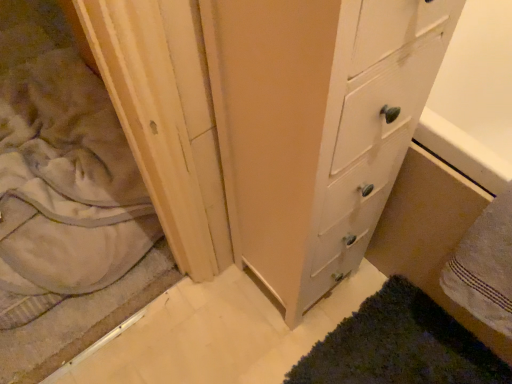
Question: Can you confirm if white textured towel at lower right is bigger than white wood chest of drawers at center?

Choices:
 (A) no
 (B) yes

Answer: (A)

Question: Is white textured towel at lower right facing away from white wood chest of drawers at center?

Choices:
 (A) no
 (B) yes

Answer: (A)

Question: Is white textured towel at lower right beside white wood chest of drawers at center?

Choices:
 (A) no
 (B) yes

Answer: (A)

Question: From a real-world perspective, is white textured towel at lower right positioned under white wood chest of drawers at center based on gravity?

Choices:
 (A) no
 (B) yes

Answer: (B)

Question: Is white textured towel at lower right located outside white wood chest of drawers at center?

Choices:
 (A) yes
 (B) no

Answer: (A)

Question: In the image, is dark green shaggy bath mat at lower right positioned in front of or behind white wood chest of drawers at center?

Choices:
 (A) front
 (B) behind

Answer: (B)

Question: From a real-world perspective, is dark green shaggy bath mat at lower right positioned above or below white wood chest of drawers at center?

Choices:
 (A) below
 (B) above

Answer: (A)

Question: From the image's perspective, relative to white wood chest of drawers at center, is dark green shaggy bath mat at lower right above or below?

Choices:
 (A) below
 (B) above

Answer: (A)

Question: Is dark green shaggy bath mat at lower right inside the boundaries of white wood chest of drawers at center, or outside?

Choices:
 (A) inside
 (B) outside

Answer: (B)

Question: From the image's perspective, is dark green shaggy bath mat at lower right located above or below beige soft fabric at left?

Choices:
 (A) below
 (B) above

Answer: (A)

Question: In terms of width, does dark green shaggy bath mat at lower right look wider or thinner when compared to beige soft fabric at left?

Choices:
 (A) wide
 (B) thin

Answer: (B)

Question: From a real-world perspective, is dark green shaggy bath mat at lower right physically located above or below beige soft fabric at left?

Choices:
 (A) above
 (B) below

Answer: (B)

Question: Based on their positions, is dark green shaggy bath mat at lower right located to the left or right of beige soft fabric at left?

Choices:
 (A) left
 (B) right

Answer: (B)

Question: Is beige soft fabric at left taller or shorter than dark green shaggy bath mat at lower right?

Choices:
 (A) short
 (B) tall

Answer: (B)

Question: Looking at their shapes, would you say beige soft fabric at left is wider or thinner than dark green shaggy bath mat at lower right?

Choices:
 (A) wide
 (B) thin

Answer: (A)